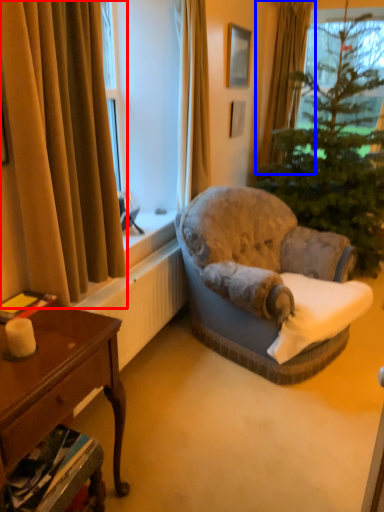
Question: Which object is further to the camera taking this photo, curtain (highlighted by a red box) or curtain (highlighted by a blue box)?

Choices:
 (A) curtain
 (B) curtain

Answer: (B)